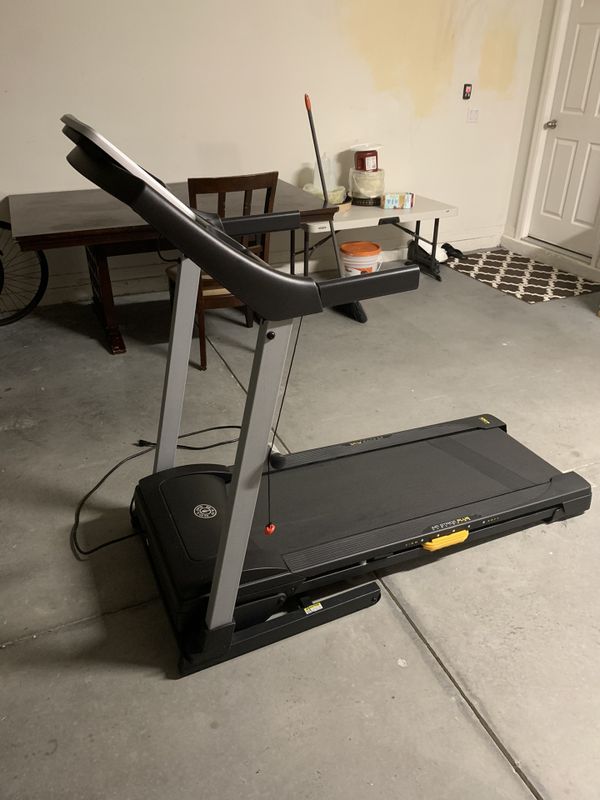
Identify the location of bucket. (362, 250).